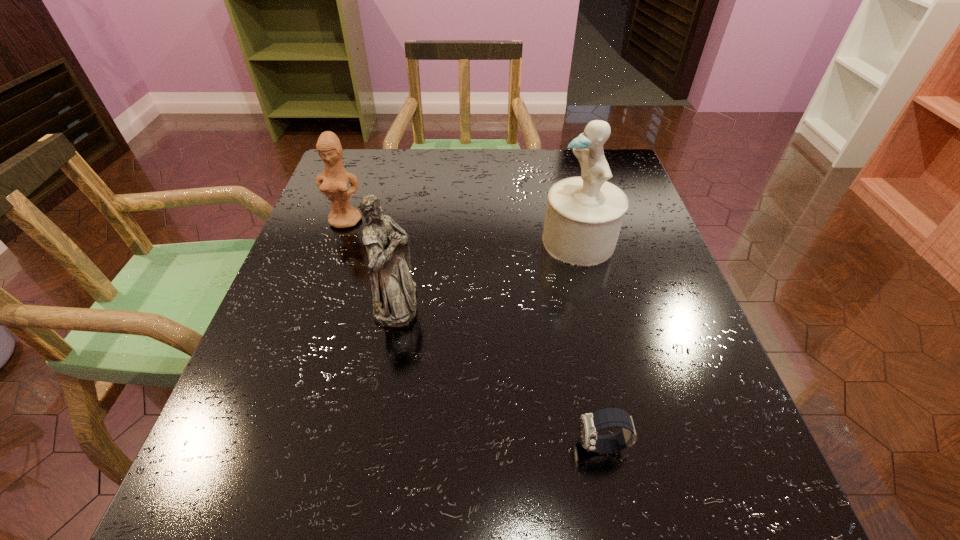
Locate an element on the screen. The image size is (960, 540). the tallest object is located at coordinates (584, 214).

I want to click on the rightmost figurine, so click(x=584, y=214).

Locate an element on the screen. The height and width of the screenshot is (540, 960). the third object from right to left is located at coordinates (394, 292).

Identify the location of the third farthest object. (394, 292).

At what (x,y) coordinates should I click in order to perform the action: click on the leftmost object. Please return your answer as a coordinate pair (x, y). Image resolution: width=960 pixels, height=540 pixels. Looking at the image, I should click on [333, 183].

The height and width of the screenshot is (540, 960). I want to click on the shortest object, so click(x=590, y=424).

At what (x,y) coordinates should I click in order to perform the action: click on the nearest object. Please return your answer as a coordinate pair (x, y). This screenshot has height=540, width=960. Looking at the image, I should click on (590, 424).

This screenshot has width=960, height=540. Identify the location of vacant space located 0.300m at the beak of the tallest object. pyautogui.click(x=409, y=241).

Where is `free region located 0.120m at the beak of the tallest object`? free region located 0.120m at the beak of the tallest object is located at coordinates (489, 241).

This screenshot has height=540, width=960. Find the location of `free spot located at the beak of the tallest object`. free spot located at the beak of the tallest object is located at coordinates coord(404,241).